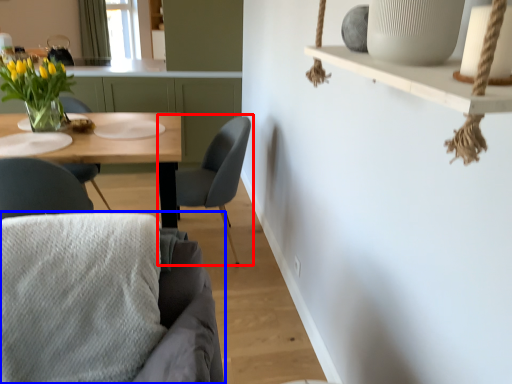
Question: Among these objects, which one is nearest to the camera, chair (highlighted by a red box) or chair (highlighted by a blue box)?

Choices:
 (A) chair
 (B) chair

Answer: (B)